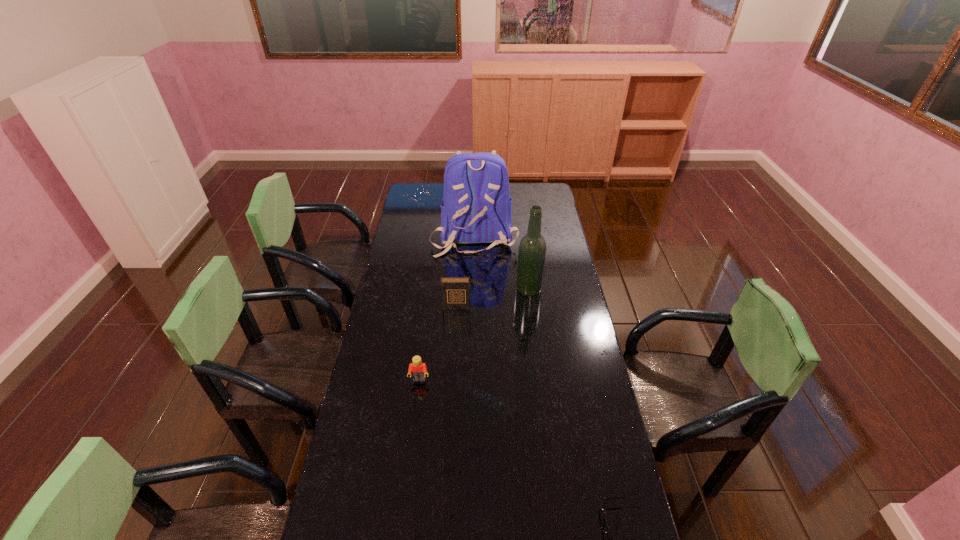
In order to click on backpack in this screenshot , I will do `click(477, 208)`.

Find the location of a particular element. The height and width of the screenshot is (540, 960). the second farthest object is located at coordinates (532, 248).

Where is `the third nearest object`? Image resolution: width=960 pixels, height=540 pixels. the third nearest object is located at coordinates (455, 291).

I want to click on the third shortest object, so click(x=455, y=291).

Locate an element on the screen. the second shortest object is located at coordinates (418, 369).

Locate an element on the screen. The image size is (960, 540). the second nearest object is located at coordinates (418, 369).

You are a GUI agent. You are given a task and a screenshot of the screen. Output one action in this format:
    pyautogui.click(x=<x>, y=<y>)
    Task: Click on the blank area located on the back of the backpack
    This screenshot has height=540, width=960.
    Given the screenshot: What is the action you would take?
    pyautogui.click(x=473, y=292)

In order to click on free space located on the back of the second farthest object in this screenshot , I will do `click(522, 238)`.

Where is `vacant space situated 0.270m on the front cover of the diary`? The height and width of the screenshot is (540, 960). vacant space situated 0.270m on the front cover of the diary is located at coordinates (453, 361).

Find the location of `vacant space located on the face of the Lego`. vacant space located on the face of the Lego is located at coordinates (413, 428).